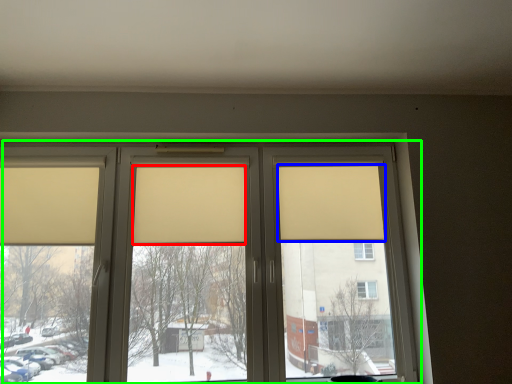
Question: Which is nearer to the curtain (highlighted by a red box)? curtain (highlighted by a blue box) or window (highlighted by a green box).

Choices:
 (A) curtain
 (B) window

Answer: (B)